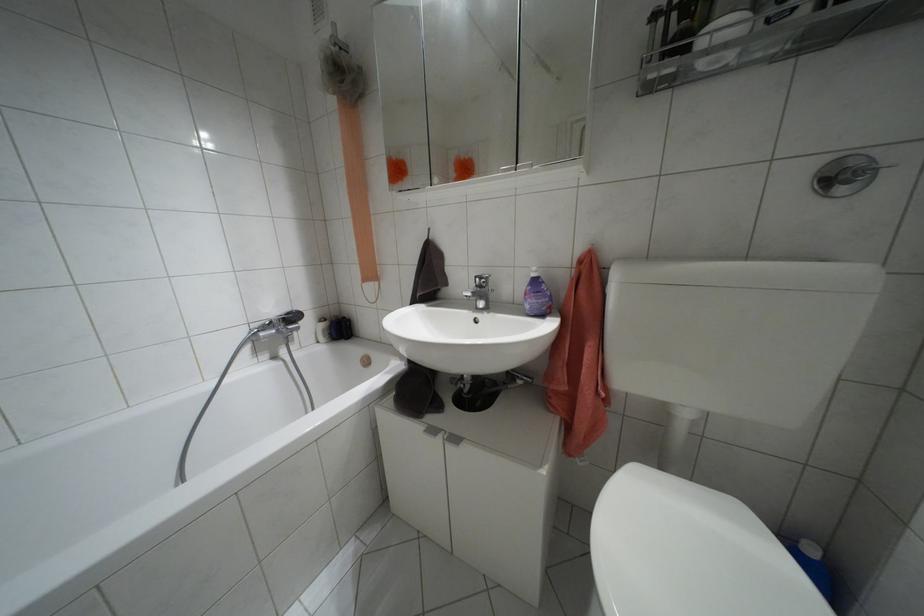
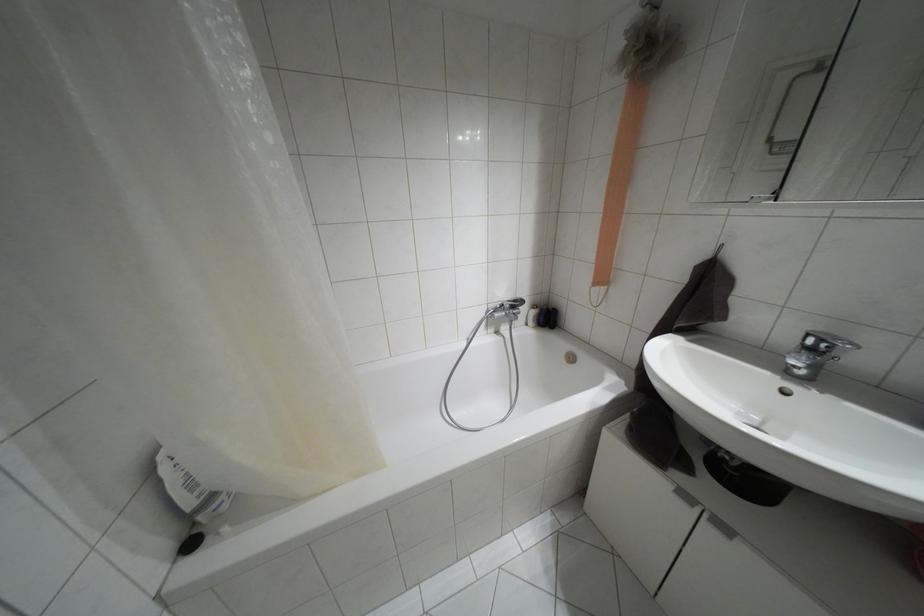
Question: I am providing you with two images of the same scene from different viewpoints. Which of the following objects are not visible in image2?

Choices:
 (A) white cabinet handle
 (B) white bottle
 (C) dark bottle
 (D) none of these

Answer: (D)